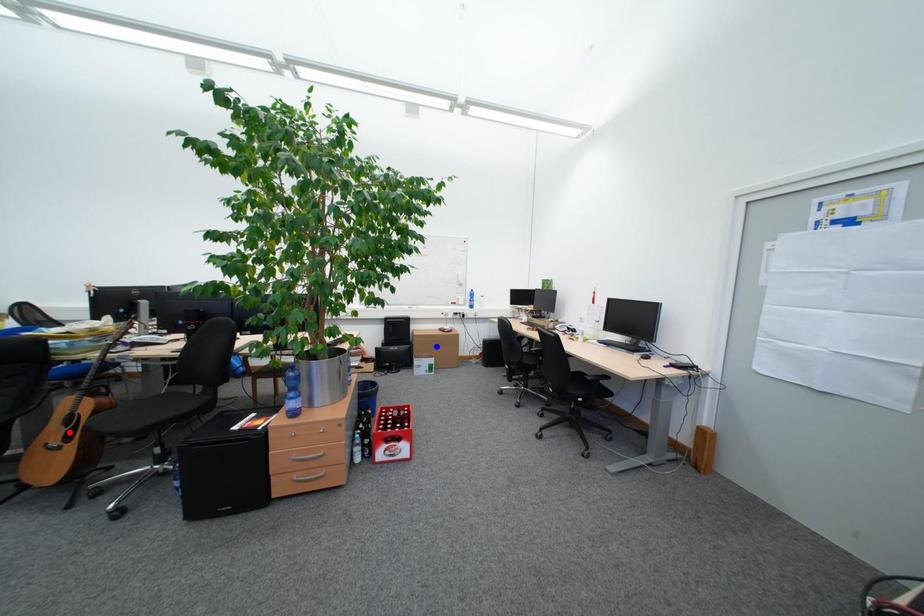
Question: Which of the two points in the image is closer to the camera?

Choices:
 (A) Blue point is closer.
 (B) Red point is closer.

Answer: (B)